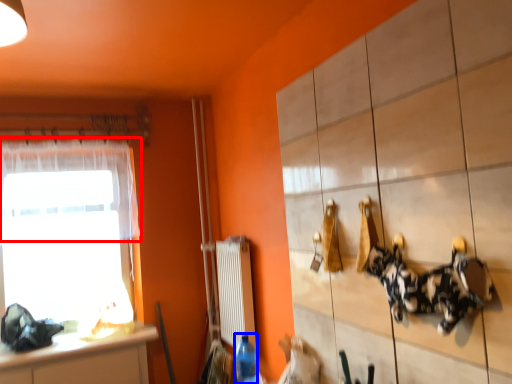
Question: Which object appears farthest to the camera in this image, curtain (highlighted by a red box) or bottle (highlighted by a blue box)?

Choices:
 (A) curtain
 (B) bottle

Answer: (A)